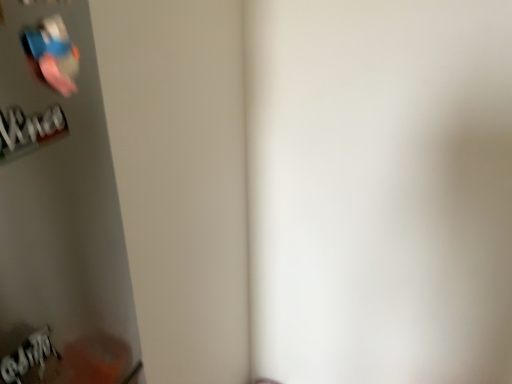
Question: Is metallic blue wii remote at upper left completely or partially inside white paper at left, marked as the first writing in a top-to-bottom arrangement?

Choices:
 (A) no
 (B) yes

Answer: (A)

Question: Considering the relative sizes of white paper at left, which is the 2th writing from bottom to top, and metallic blue wii remote at upper left in the image provided, is white paper at left, which is the 2th writing from bottom to top, taller than metallic blue wii remote at upper left?

Choices:
 (A) no
 (B) yes

Answer: (A)

Question: From a real-world perspective, is white paper at left, which is the 2th writing from bottom to top, positioned over metallic blue wii remote at upper left based on gravity?

Choices:
 (A) no
 (B) yes

Answer: (A)

Question: Are white paper at left, marked as the first writing in a top-to-bottom arrangement, and metallic blue wii remote at upper left far apart?

Choices:
 (A) no
 (B) yes

Answer: (A)

Question: Considering the relative positions of white paper at left, marked as the first writing in a top-to-bottom arrangement, and metallic blue wii remote at upper left in the image provided, is white paper at left, marked as the first writing in a top-to-bottom arrangement, to the right of metallic blue wii remote at upper left from the viewer's perspective?

Choices:
 (A) yes
 (B) no

Answer: (B)

Question: Is point (31, 39) positioned closer to the camera than point (61, 129)?

Choices:
 (A) closer
 (B) farther

Answer: (A)

Question: In terms of height, does metallic blue wii remote at upper left look taller or shorter compared to white paper at left, which is the 2th writing from bottom to top?

Choices:
 (A) short
 (B) tall

Answer: (B)

Question: Is metallic blue wii remote at upper left to the left or to the right of white paper at left, marked as the first writing in a top-to-bottom arrangement, in the image?

Choices:
 (A) right
 (B) left

Answer: (A)

Question: Choose the correct answer: Is metallic blue wii remote at upper left inside white paper at left, which is the 2th writing from bottom to top, or outside it?

Choices:
 (A) inside
 (B) outside

Answer: (B)

Question: From a real-world perspective, is white paper at left, which is the 2th writing from bottom to top, physically located above or below metallic blue wii remote at upper left?

Choices:
 (A) below
 (B) above

Answer: (A)

Question: Is point (20, 130) positioned closer to the camera than point (34, 24)?

Choices:
 (A) farther
 (B) closer

Answer: (A)

Question: Is white paper at left, which is the 2th writing from bottom to top, in front of or behind metallic blue wii remote at upper left in the image?

Choices:
 (A) front
 (B) behind

Answer: (A)

Question: In terms of height, does white paper at left, which is the 2th writing from bottom to top, look taller or shorter compared to metallic blue wii remote at upper left?

Choices:
 (A) short
 (B) tall

Answer: (A)

Question: From a real-world perspective, is metallic blue wii remote at upper left physically located above or below white paper at lower left, the second writing in the top-to-bottom sequence?

Choices:
 (A) above
 (B) below

Answer: (A)

Question: In terms of width, does metallic blue wii remote at upper left look wider or thinner when compared to white paper at lower left, the 1th writing in the bottom-to-top sequence?

Choices:
 (A) wide
 (B) thin

Answer: (B)